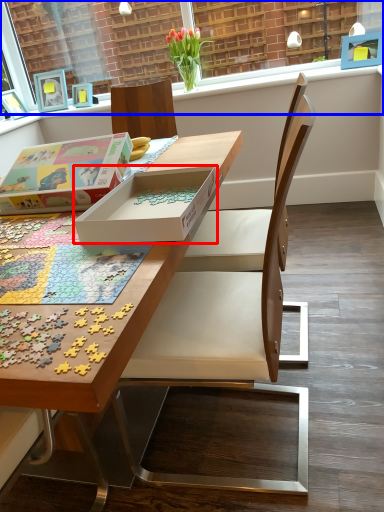
Question: Which object appears farthest to the camera in this image, box (highlighted by a red box) or window frame (highlighted by a blue box)?

Choices:
 (A) box
 (B) window frame

Answer: (B)